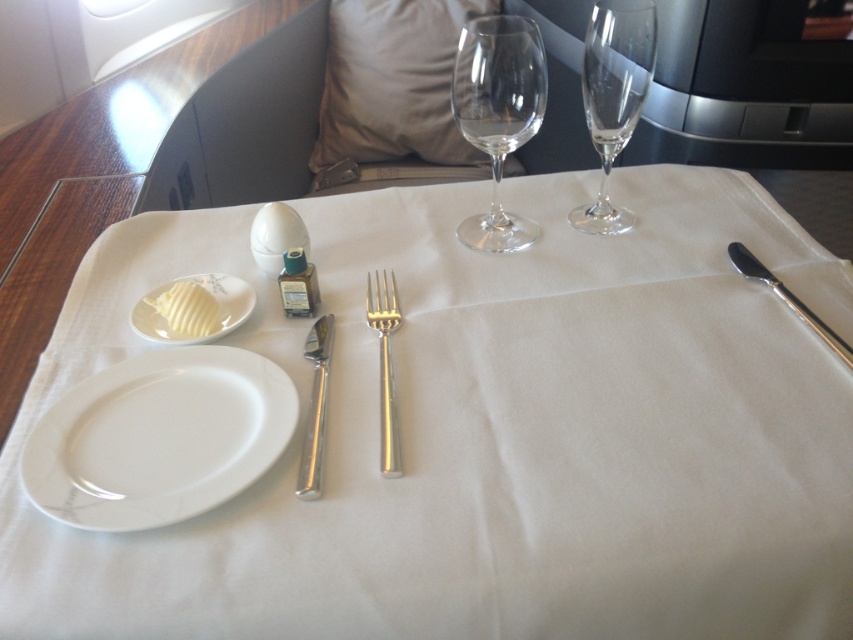
Question: Does white porcelain plate at upper left have a greater width compared to polished silver knife at right?

Choices:
 (A) yes
 (B) no

Answer: (A)

Question: Which point is closer to the camera taking this photo?

Choices:
 (A) (257, 410)
 (B) (392, 310)

Answer: (A)

Question: Which point is farther to the camera?

Choices:
 (A) (308, 420)
 (B) (611, 106)
 (C) (45, 428)
 (D) (798, 310)

Answer: (B)

Question: Is transparent glass wine glass at center closer to the viewer compared to white porcelain plate at upper left?

Choices:
 (A) no
 (B) yes

Answer: (A)

Question: Can you confirm if white porcelain plate at lower left is wider than transparent glass wine glass at center?

Choices:
 (A) yes
 (B) no

Answer: (A)

Question: Which of the following is the farthest from the observer?

Choices:
 (A) polished silver knife at center-left
 (B) white porcelain plate at upper left
 (C) transparent glass wine glass at center

Answer: (C)